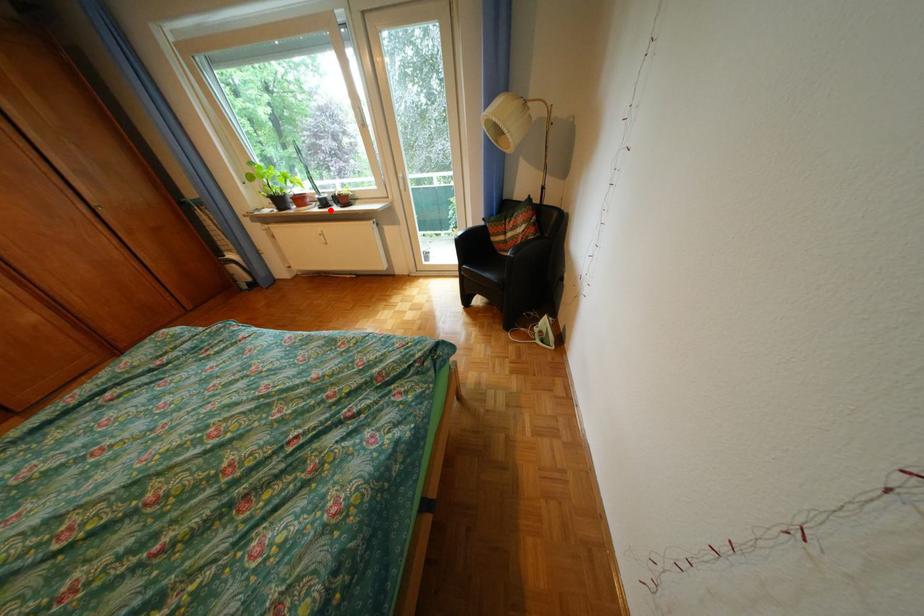
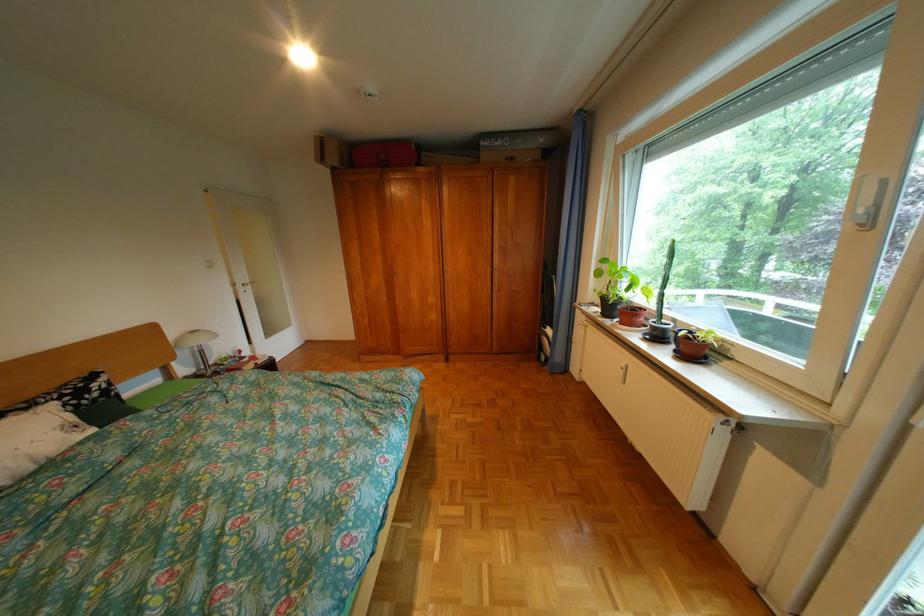
Where in the second image is the point corresponding to the highlighted location from the first image?

(650, 338)